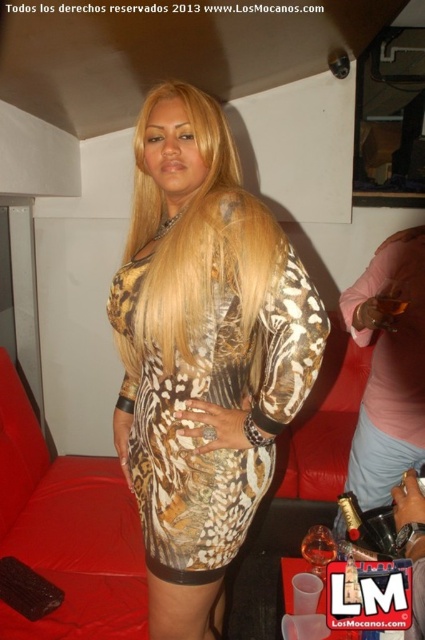
You are a photographer at the event and want to ensure that the blondehair at center and the metallic gold bracelet at upper right are both visible in the photo. Based on their heights, which object should you focus on first to ensure both are in frame?

Since the blondehair at center is shorter than the metallic gold bracelet at upper right, you should focus on the metallic gold bracelet at upper right first to ensure both are in frame.